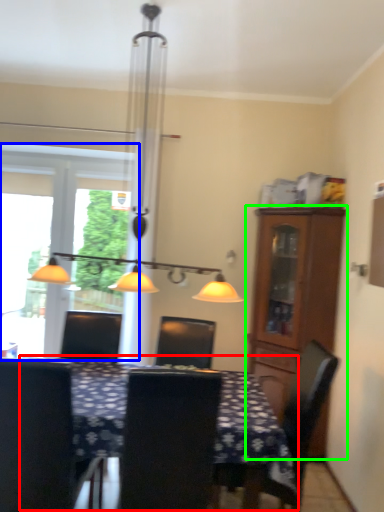
Question: Considering the real-world distances, which object is farthest from table (highlighted by a red box)? window (highlighted by a blue box) or cabinetry (highlighted by a green box)?

Choices:
 (A) window
 (B) cabinetry

Answer: (A)